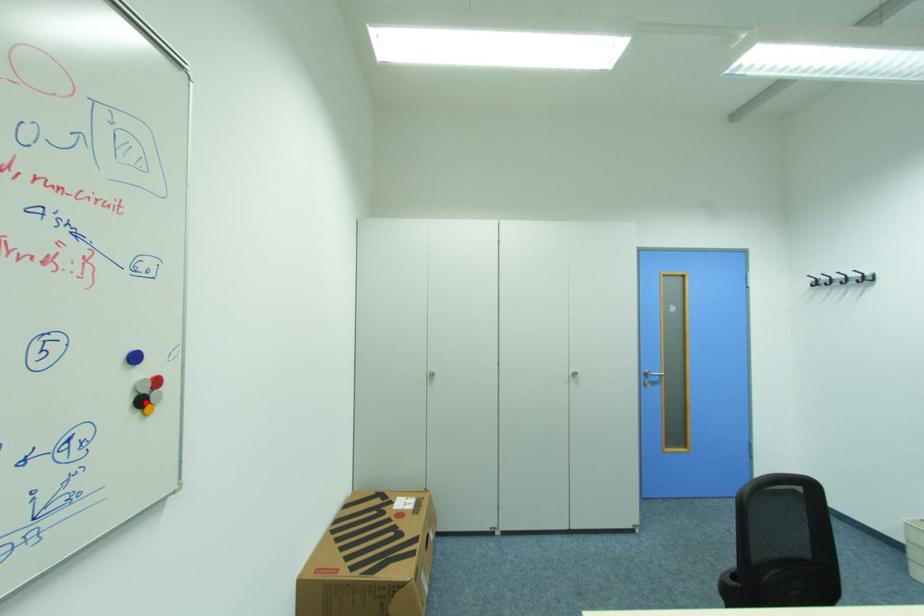
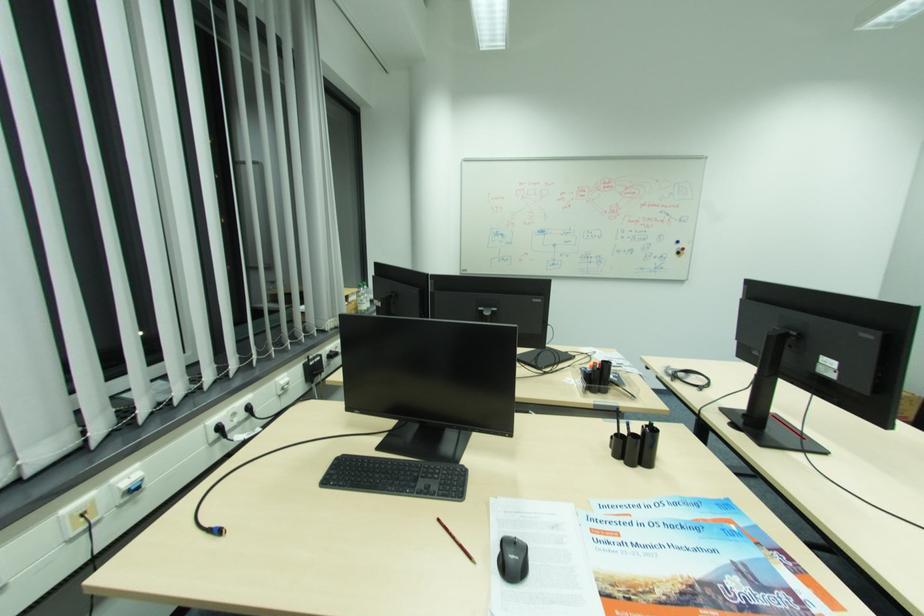
In the second image, find the point that corresponds to the highlighted location in the first image.

(684, 253)